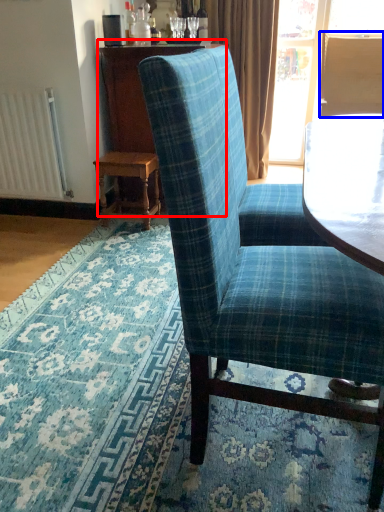
Question: Which object is closer to the camera taking this photo, dresser (highlighted by a red box) or back (highlighted by a blue box)?

Choices:
 (A) dresser
 (B) back

Answer: (A)